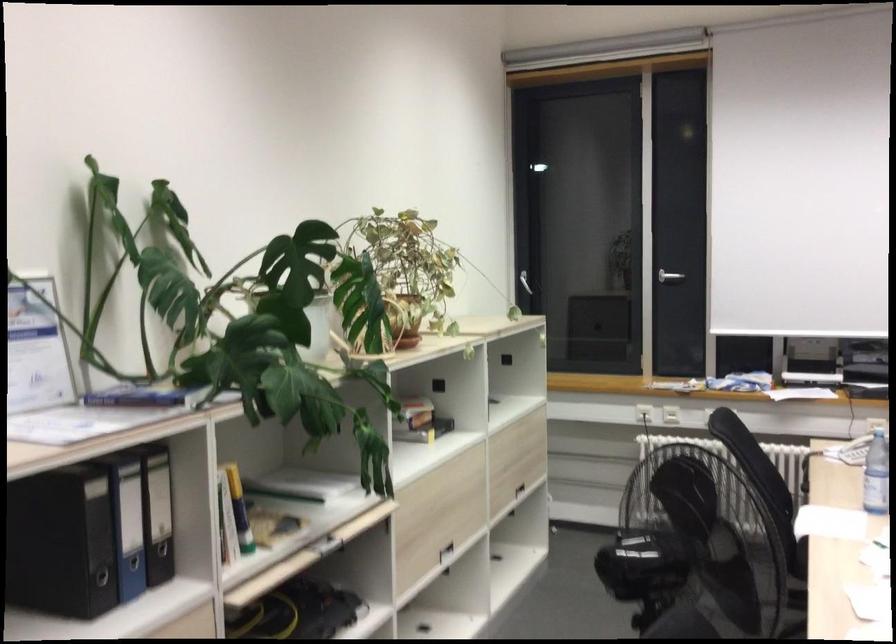
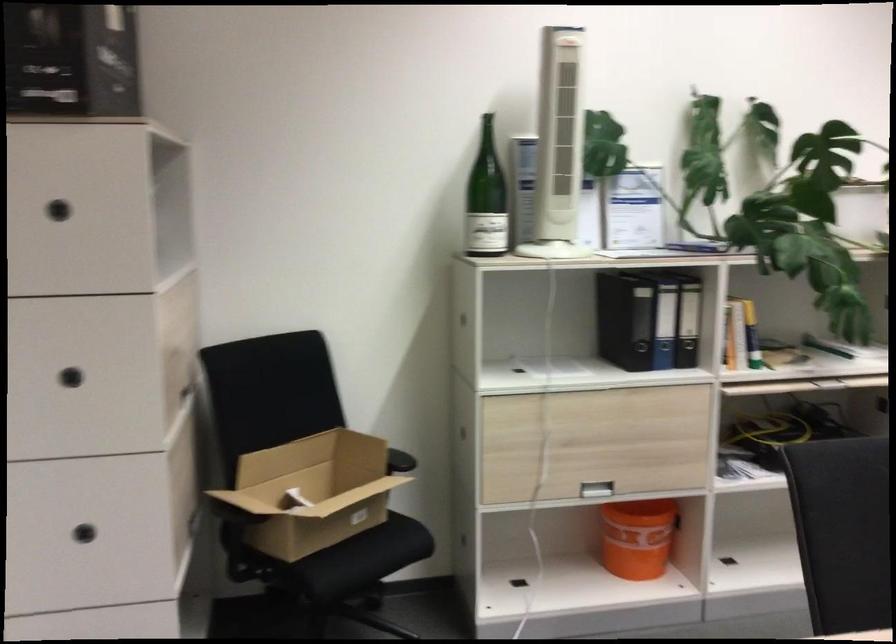
Find the pixel in the second image that matches the point at 161,518 in the first image.

(688, 321)